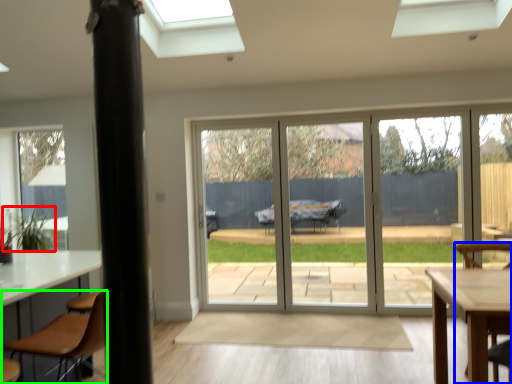
Question: Which object is positioned farthest from plant (highlighted by a red box)? Select from chair (highlighted by a blue box) and chair (highlighted by a green box).

Choices:
 (A) chair
 (B) chair

Answer: (A)